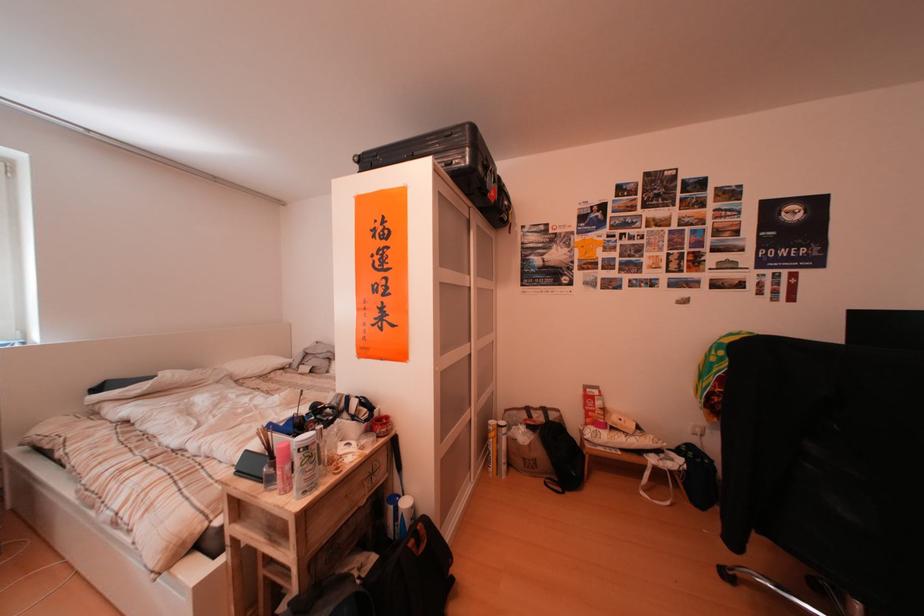
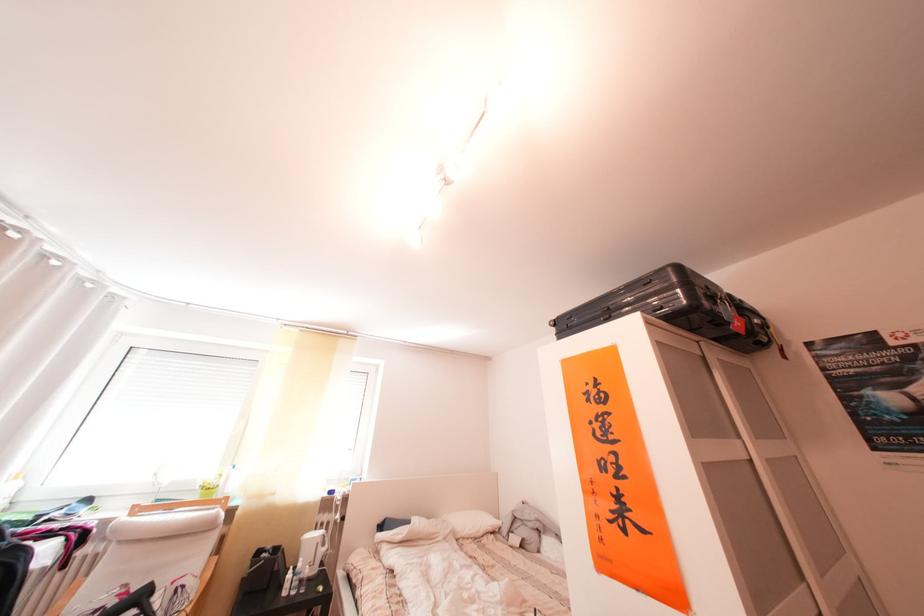
Question: I am providing you with two images of the same scene from different viewpoints. Which of the following objects are not visible in image2?

Choices:
 (A) wardrobe door handle
 (B) small green pot
 (C) grey stuffed animal
 (D) none of these

Answer: (D)